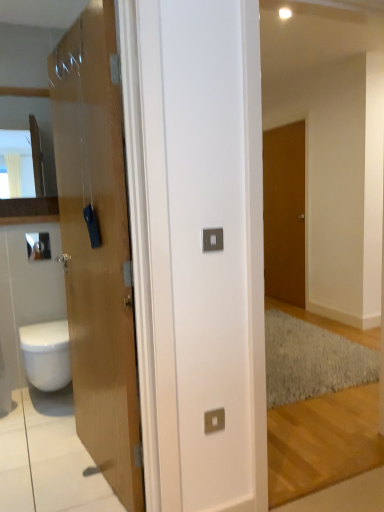
Question: Is metallic square at center, the 2th electric outlet in the top-to-bottom sequence, positioned with its back to matte wood cabinet at left?

Choices:
 (A) yes
 (B) no

Answer: (B)

Question: Does metallic square at center, which is the first electric outlet in back-to-front order, have a lesser height compared to matte wood cabinet at left?

Choices:
 (A) no
 (B) yes

Answer: (B)

Question: Does metallic square at center, arranged as the first electric outlet when ordered from the bottom, have a greater width compared to matte wood cabinet at left?

Choices:
 (A) yes
 (B) no

Answer: (B)

Question: Is metallic square at center, which is the first electric outlet in back-to-front order, taller than matte wood cabinet at left?

Choices:
 (A) yes
 (B) no

Answer: (B)

Question: Could you tell me if metallic square at center, the second electric outlet from the front, is turned towards matte wood cabinet at left?

Choices:
 (A) yes
 (B) no

Answer: (B)

Question: Considering their positions, is brown matte door at center-right, which is the 2th door from front to back, located in front of or behind metallic square at center, which is the first electric outlet in back-to-front order?

Choices:
 (A) front
 (B) behind

Answer: (B)

Question: In the image, is brown matte door at center-right, positioned as the second door in left-to-right order, on the left side or the right side of metallic square at center, which is the first electric outlet in back-to-front order?

Choices:
 (A) right
 (B) left

Answer: (A)

Question: Is brown matte door at center-right, which is the 2th door from front to back, wider or thinner than metallic square at center, which is the first electric outlet in back-to-front order?

Choices:
 (A) wide
 (B) thin

Answer: (A)

Question: Is brown matte door at center-right, which is the 1th door in right-to-left order, taller or shorter than metallic square at center, arranged as the first electric outlet when ordered from the bottom?

Choices:
 (A) tall
 (B) short

Answer: (A)

Question: In terms of height, does satin silver switch at center, the 2th electric outlet in the bottom-to-top sequence, look taller or shorter compared to white glossy bidet at lower left?

Choices:
 (A) tall
 (B) short

Answer: (B)

Question: Is satin silver switch at center, acting as the 1th electric outlet starting from the front, inside or outside of white glossy bidet at lower left?

Choices:
 (A) outside
 (B) inside

Answer: (A)

Question: Is satin silver switch at center, which is counted as the 1th electric outlet, starting from the top, bigger or smaller than white glossy bidet at lower left?

Choices:
 (A) small
 (B) big

Answer: (A)

Question: In the image, is satin silver switch at center, acting as the 1th electric outlet starting from the front, positioned in front of or behind white glossy bidet at lower left?

Choices:
 (A) front
 (B) behind

Answer: (A)

Question: From a real-world perspective, is satin silver switch at center, acting as the 1th electric outlet starting from the front, positioned above or below metallic square at center, arranged as the first electric outlet when ordered from the bottom?

Choices:
 (A) below
 (B) above

Answer: (B)

Question: Is point (215, 241) closer or farther from the camera than point (211, 423)?

Choices:
 (A) closer
 (B) farther

Answer: (A)